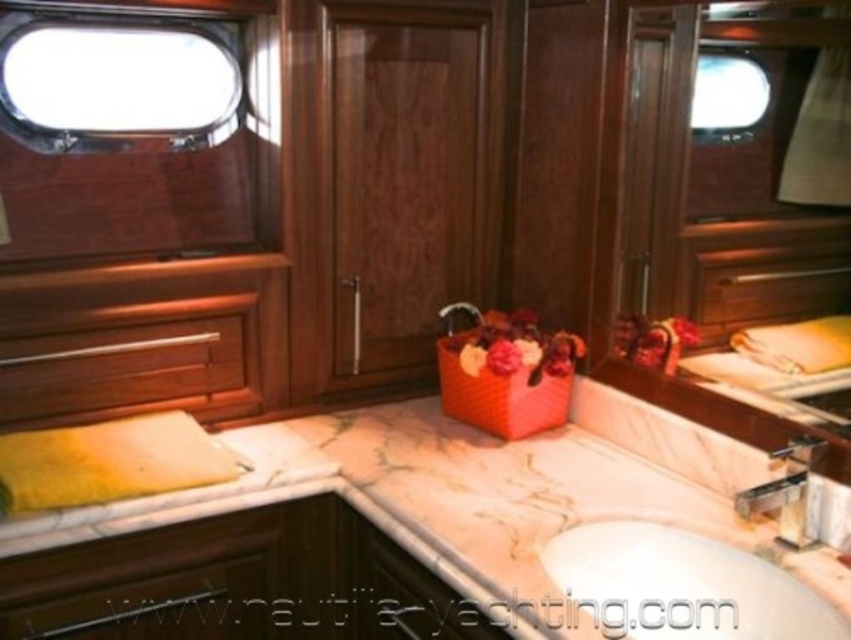
Which of these two, white glossy sink at center or satin nickel faucet at center, stands shorter?

With less height is satin nickel faucet at center.

Can you confirm if white glossy sink at center is thinner than satin nickel faucet at center?

No.

In the scene shown: Who is more forward, (597,584) or (438,314)?

Positioned in front is point (597,584).

I want to click on white glossy sink at center, so click(x=683, y=586).

Which of these two, marble at center or satin nickel faucet at center, stands taller?

Standing taller between the two is marble at center.

Which is more to the right, marble at center or satin nickel faucet at center?

Positioned to the right is satin nickel faucet at center.

Between point (141, 524) and point (450, 324), which one is positioned behind?

The point (450, 324) is more distant.

I want to click on marble at center, so click(414, 538).

Which is more to the right, glossy wood mirror at upper right or silver metallic faucet at center?

silver metallic faucet at center

Is point (766, 118) behind point (760, 509)?

Yes, point (766, 118) is behind point (760, 509).

At what (x,y) coordinates should I click in order to perform the action: click on glossy wood mirror at upper right. Please return your answer as a coordinate pair (x, y). The width and height of the screenshot is (851, 640). Looking at the image, I should click on (717, 188).